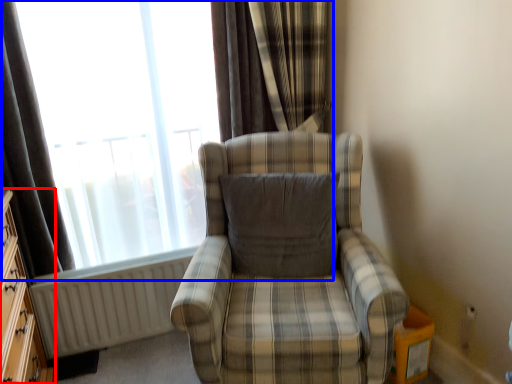
Question: Which of the following is the farthest to the observer, dresser (highlighted by a red box) or window (highlighted by a blue box)?

Choices:
 (A) dresser
 (B) window

Answer: (B)